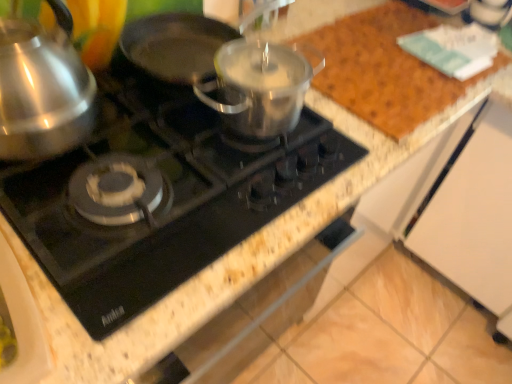
Question: Does point (39, 33) appear closer or farther from the camera than point (181, 157)?

Choices:
 (A) closer
 (B) farther

Answer: (A)

Question: Would you say satin silver kettle at left is to the left or to the right of black glass gas stove at center in the picture?

Choices:
 (A) left
 (B) right

Answer: (A)

Question: Looking at the image, does satin silver kettle at left seem bigger or smaller compared to black glass gas stove at center?

Choices:
 (A) big
 (B) small

Answer: (B)

Question: Is black glass gas stove at center inside or outside of satin silver kettle at left?

Choices:
 (A) inside
 (B) outside

Answer: (B)

Question: Considering their positions, is black glass gas stove at center located in front of or behind satin silver kettle at left?

Choices:
 (A) behind
 (B) front

Answer: (A)

Question: Is black glass gas stove at center taller or shorter than satin silver kettle at left?

Choices:
 (A) tall
 (B) short

Answer: (B)

Question: From a real-world perspective, is black glass gas stove at center physically located above or below satin silver kettle at left?

Choices:
 (A) below
 (B) above

Answer: (A)